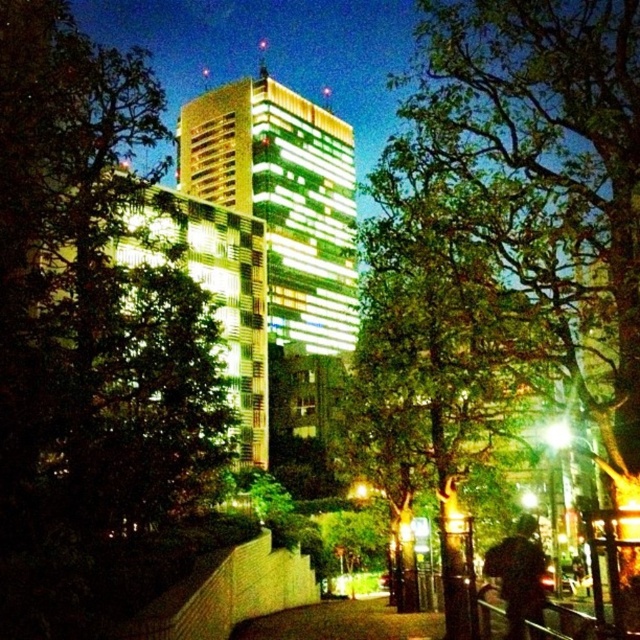
Question: Considering the relative positions of green leafy tree at center and dark concrete sidewalk at center in the image provided, where is green leafy tree at center located with respect to dark concrete sidewalk at center?

Choices:
 (A) above
 (B) below

Answer: (A)

Question: Among these objects, which one is farthest from the camera?

Choices:
 (A) green leafy tree at center
 (B) dark concrete sidewalk at center

Answer: (B)

Question: Which point is farther to the camera?

Choices:
 (A) dark concrete sidewalk at center
 (B) green leafy tree at center

Answer: (A)

Question: Is green leafy tree at center wider than dark concrete sidewalk at center?

Choices:
 (A) no
 (B) yes

Answer: (B)

Question: Is green leafy tree at center behind dark concrete sidewalk at center?

Choices:
 (A) no
 (B) yes

Answer: (A)

Question: Which object is closer to the camera taking this photo?

Choices:
 (A) dark concrete sidewalk at center
 (B) green leafy tree at center

Answer: (B)